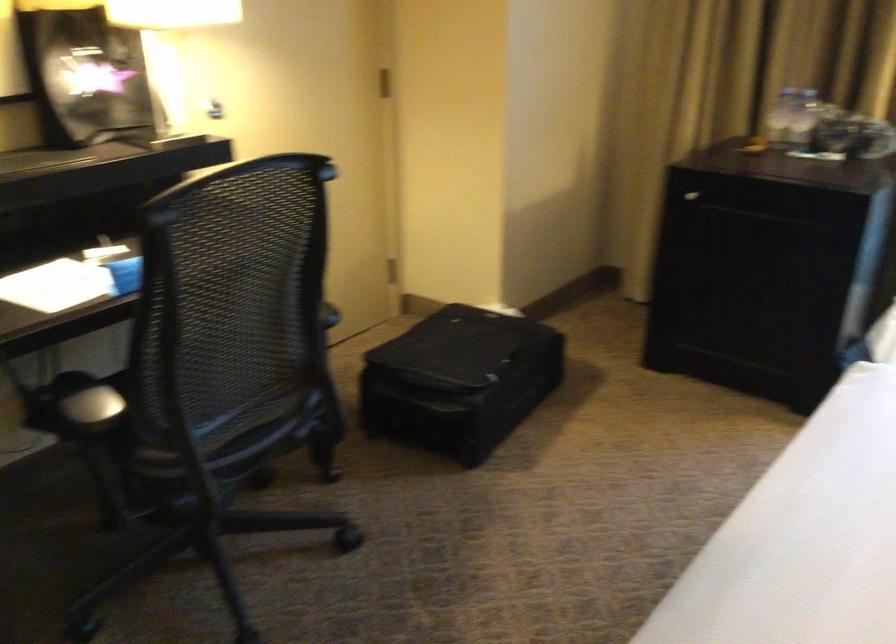
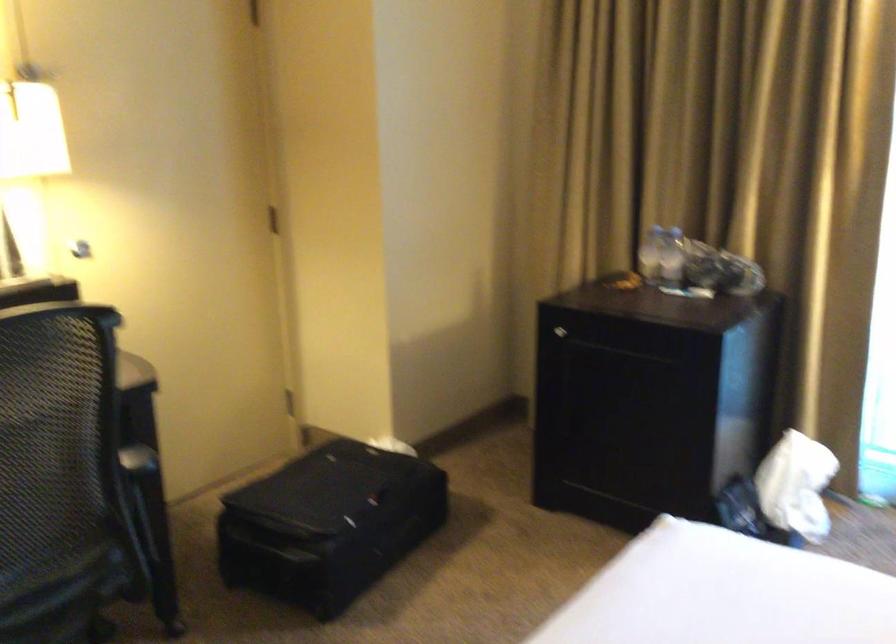
The point at (685, 196) is marked in the first image. Where is the corresponding point in the second image?

(560, 330)